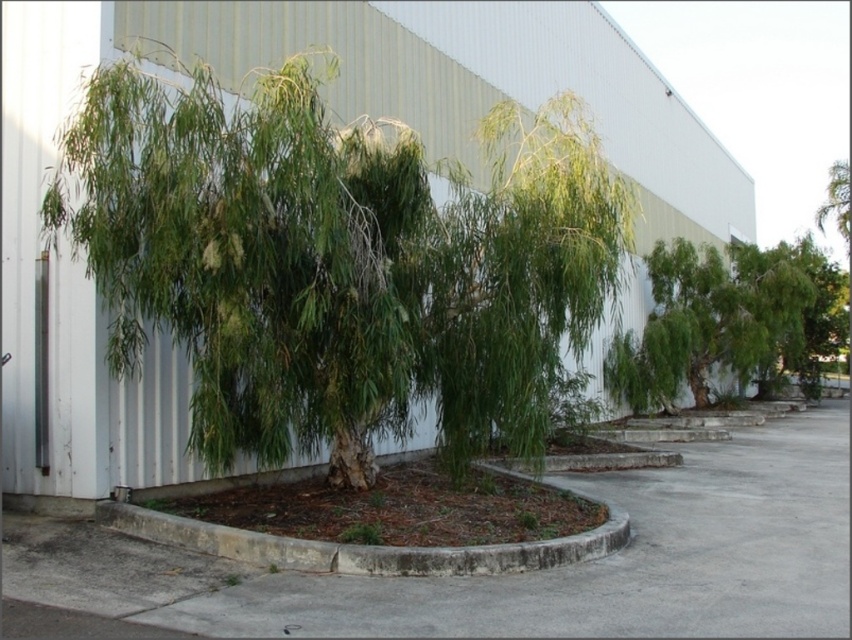
Is green leafy tree at right to the right of green leafy shrub at center from the viewer's perspective?

Indeed, green leafy tree at right is positioned on the right side of green leafy shrub at center.

Who is positioned more to the right, green leafy tree at right or green leafy shrub at center?

green leafy tree at right

The width and height of the screenshot is (852, 640). What do you see at coordinates (727, 321) in the screenshot?
I see `green leafy tree at right` at bounding box center [727, 321].

Find the location of a particular element. Image resolution: width=852 pixels, height=640 pixels. green leafy tree at right is located at coordinates (727, 321).

In the scene shown: Who is taller, green leafy willow at center or green leafy tree at right?

With more height is green leafy tree at right.

Can you confirm if green leafy willow at center is wider than green leafy tree at right?

No.

You are a GUI agent. You are given a task and a screenshot of the screen. Output one action in this format:
    pyautogui.click(x=<x>, y=<y>)
    Task: Click on the green leafy willow at center
    The height and width of the screenshot is (640, 852).
    Given the screenshot: What is the action you would take?
    pyautogui.click(x=337, y=260)

Identify the location of green leafy willow at center. Image resolution: width=852 pixels, height=640 pixels. [x=337, y=260].

Is green leafy willow at center bigger than gray concrete pavement at center?

Actually, green leafy willow at center might be smaller than gray concrete pavement at center.

How far apart are green leafy willow at center and gray concrete pavement at center?

They are 4.31 meters apart.

Between point (216, 120) and point (10, 536), which one is positioned behind?

Point (10, 536)

The image size is (852, 640). I want to click on green leafy willow at center, so click(x=337, y=260).